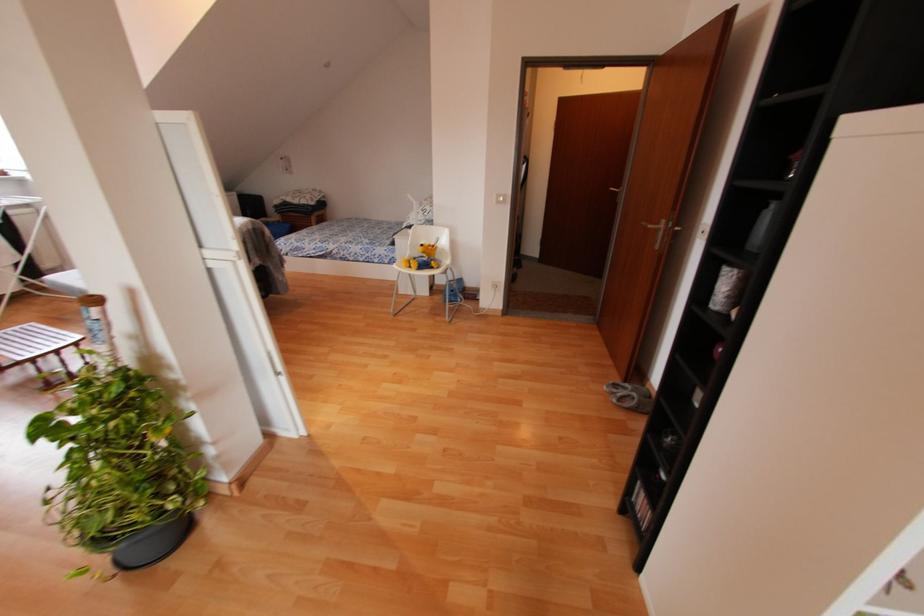
Find where to lift the yellow stuffed toy. Please return your answer as a coordinate pair (x, y).

(421, 257)